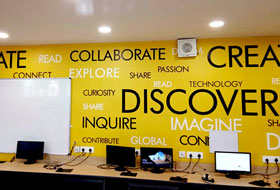
Locate an element on the screen. The width and height of the screenshot is (280, 190). three double outlet covers is located at coordinates (274, 162), (192, 156), (87, 153).